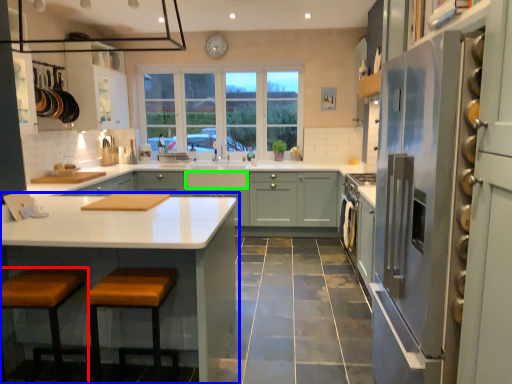
Question: Estimate the real-world distances between objects in this image. Which object is closer to stool (highlighted by a red box), cabinetry (highlighted by a blue box) or drawer (highlighted by a green box)?

Choices:
 (A) cabinetry
 (B) drawer

Answer: (A)